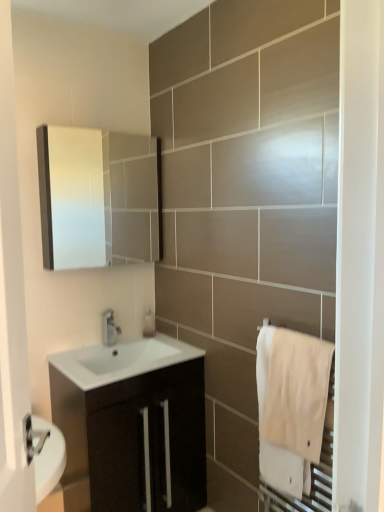
At what (x,y) coordinates should I click in order to perform the action: click on white glossy sink at center. Please return your answer as a coordinate pair (x, y). This screenshot has height=512, width=384. Looking at the image, I should click on (128, 356).

Where is `matte white medicine cabinet at upper left`? matte white medicine cabinet at upper left is located at coordinates tap(71, 197).

Considering the relative sizes of white glossy sink at center and clear plastic soap dispenser at center in the image provided, is white glossy sink at center wider than clear plastic soap dispenser at center?

Yes.

Is white glossy sink at center far away from clear plastic soap dispenser at center?

No.

From the image's perspective, between white glossy sink at center and clear plastic soap dispenser at center, who is located below?

From the image's view, white glossy sink at center is below.

From a real-world perspective, who is located lower, clear plastic soap dispenser at center or white glossy sink at center?

white glossy sink at center, from a real-world perspective.

Which is correct: clear plastic soap dispenser at center is inside white glossy sink at center, or outside of it?

clear plastic soap dispenser at center is located beyond the bounds of white glossy sink at center.

Which is behind, point (145, 318) or point (103, 369)?

Positioned behind is point (145, 318).

Is the position of clear plastic soap dispenser at center less distant than that of white glossy sink at center?

No, it is not.

This screenshot has width=384, height=512. Identify the location of bath towel above the white glossy sink at center (from a real-world perspective). (291, 406).

Considering their positions, is white glossy sink at center located in front of or behind white cotton towel at right?

white glossy sink at center is behind white cotton towel at right.

From a real-world perspective, is white glossy sink at center above or below white cotton towel at right?

From a real-world perspective, white glossy sink at center is physically below white cotton towel at right.

Does white glossy sink at center appear on the right side of white cotton towel at right?

Incorrect, white glossy sink at center is not on the right side of white cotton towel at right.

This screenshot has width=384, height=512. I want to click on bath towel that appears in front of the white glossy sink at center, so click(x=291, y=406).

From the image's perspective, is white cotton towel at right above or below white glossy sink at center?

Based on their image positions, white cotton towel at right is located above white glossy sink at center.

Between white cotton towel at right and white glossy sink at center, which one has smaller width?

white cotton towel at right is thinner.

Could you tell me if white cotton towel at right is turned towards white glossy sink at center?

No, white cotton towel at right does not turn towards white glossy sink at center.

Is white glossy sink at center wider or thinner than satin nickel faucet at center?

Clearly, white glossy sink at center has more width compared to satin nickel faucet at center.

Based on their sizes in the image, would you say white glossy sink at center is bigger or smaller than satin nickel faucet at center?

Clearly, white glossy sink at center is larger in size than satin nickel faucet at center.

Would you consider white glossy sink at center to be distant from satin nickel faucet at center?

They are positioned close to each other.

Between white glossy sink at center and satin nickel faucet at center, which one appears on the left side from the viewer's perspective?

From the viewer's perspective, satin nickel faucet at center appears more on the left side.

Looking at this image, measure the distance from matte black cabinet at center to white cotton towel at right.

65.34 centimeters.

From the image's perspective, is matte black cabinet at center on white cotton towel at right?

No.

Who is bigger, matte black cabinet at center or white cotton towel at right?

Bigger between the two is matte black cabinet at center.

Is point (112, 368) less distant than point (281, 429)?

That is False.

Consider the image. Which is correct: satin nickel faucet at center is inside clear plastic soap dispenser at center, or outside of it?

The correct answer is: outside.

In the scene shown: Which of these two, satin nickel faucet at center or clear plastic soap dispenser at center, stands taller?

Standing taller between the two is satin nickel faucet at center.

Is satin nickel faucet at center thinner than clear plastic soap dispenser at center?

No.

Locate an element on the screen. This screenshot has width=384, height=512. soap dispenser that appears behind the white glossy sink at center is located at coordinates (149, 324).

Locate an element on the screen. sink in front of the clear plastic soap dispenser at center is located at coordinates (128, 356).

From the image, which object appears to be nearer to clear plastic soap dispenser at center, satin nickel faucet at center or white glossy sink at center?

The object closer to clear plastic soap dispenser at center is satin nickel faucet at center.

Considering their positions, is matte white medicine cabinet at upper left positioned further to satin nickel faucet at center than white glossy sink at center?

matte white medicine cabinet at upper left lies further to satin nickel faucet at center than the other object.

Estimate the real-world distances between objects in this image. Which object is further from matte black cabinet at center, satin nickel faucet at center or matte white medicine cabinet at upper left?

Based on the image, matte white medicine cabinet at upper left appears to be further to matte black cabinet at center.

Estimate the real-world distances between objects in this image. Which object is closer to white cotton towel at right, matte white medicine cabinet at upper left or white glossy sink at center?

white glossy sink at center is positioned closer to the anchor white cotton towel at right.

Considering their positions, is satin nickel faucet at center positioned closer to white glossy sink at center than matte black cabinet at center?

The object closer to white glossy sink at center is satin nickel faucet at center.

Consider the image. When comparing their distances from white cotton towel at right, does white glossy sink at center or matte black cabinet at center seem closer?

matte black cabinet at center lies closer to white cotton towel at right than the other object.

Considering their positions, is satin nickel faucet at center positioned further to clear plastic soap dispenser at center than matte black cabinet at center?

Based on the image, matte black cabinet at center appears to be further to clear plastic soap dispenser at center.

Based on the photo, when comparing their distances from white cotton towel at right, does clear plastic soap dispenser at center or satin nickel faucet at center seem closer?

Among the two, satin nickel faucet at center is located nearer to white cotton towel at right.

Locate an element on the screen. This screenshot has width=384, height=512. soap dispenser between matte white medicine cabinet at upper left and satin nickel faucet at center vertically is located at coordinates (149, 324).

Identify the location of sink between satin nickel faucet at center and matte black cabinet at center in the vertical direction. pos(128,356).

Where is `tap located between white cotton towel at right and clear plastic soap dispenser at center in the depth direction`? This screenshot has width=384, height=512. tap located between white cotton towel at right and clear plastic soap dispenser at center in the depth direction is located at coordinates (109, 328).

At what (x,y) coordinates should I click in order to perform the action: click on bath towel between matte white medicine cabinet at upper left and white glossy sink at center in the up-down direction. Please return your answer as a coordinate pair (x, y). Looking at the image, I should click on (291, 406).